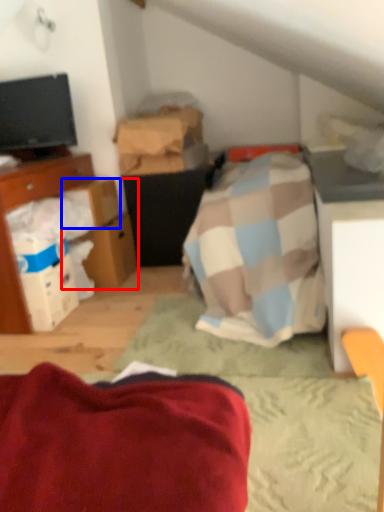
Question: Which object appears closest to the camera in this image, cardboard box (highlighted by a red box) or cardboard box (highlighted by a blue box)?

Choices:
 (A) cardboard box
 (B) cardboard box

Answer: (B)